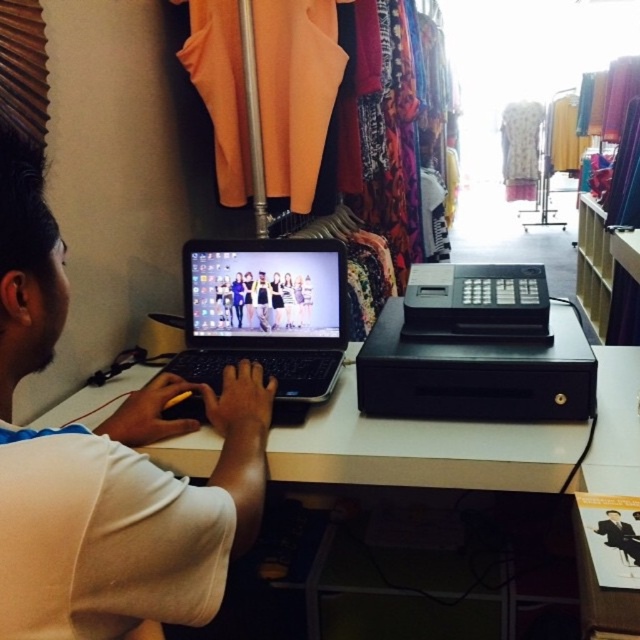
You are a customer in the store and want to check the price of an item. The store has a policy that all price checks must be done on the laptop located at the specified coordinates. Given that the laptop is at point (106,465), can you confirm if the white matte laptop at center is the correct one to use for this task?

The white matte laptop at center is located at point (106,465), so yes, it is the correct one to use for checking prices as per the store policy.

You are a customer in the store and want to place an item on the surface between the white matte laptop at center and the white matte table at center. Which object should you place it closer to if you want it to be on the larger surface?

The white matte table at center is larger than the white matte laptop at center. Place the item closer to the white matte table at center for a larger surface.